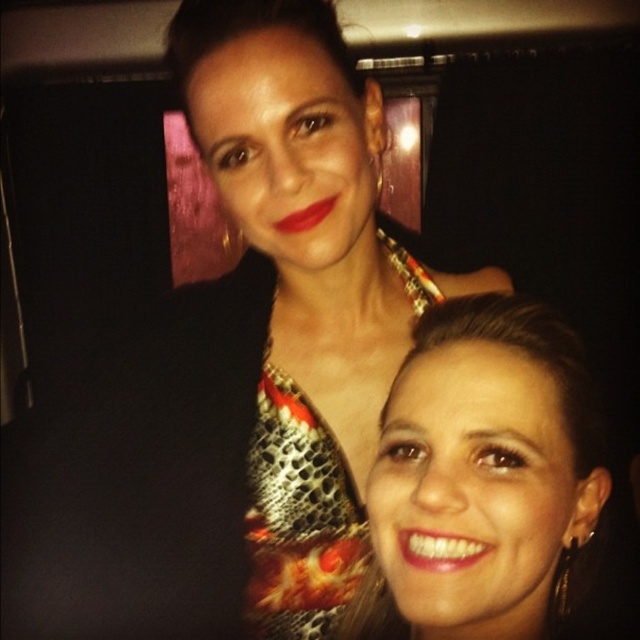
Which of these two, matte gold earrings at lower right or metallic snakeskin dress at center, stands shorter?

Standing shorter between the two is matte gold earrings at lower right.

Is matte gold earrings at lower right thinner than metallic snakeskin dress at center?

Incorrect, matte gold earrings at lower right's width is not less than metallic snakeskin dress at center's.

In order to click on matte gold earrings at lower right in this screenshot , I will do `click(483, 477)`.